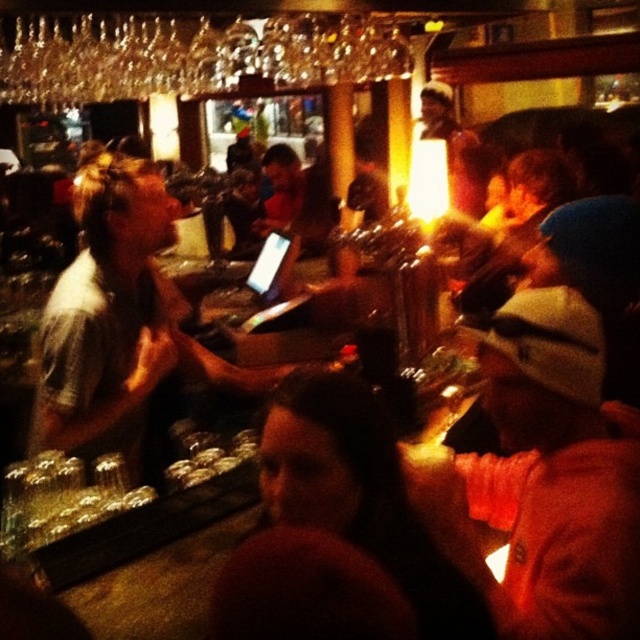
The width and height of the screenshot is (640, 640). What do you see at coordinates (563, 536) in the screenshot? I see `orange knit cap at lower right` at bounding box center [563, 536].

How much distance is there between orange knit cap at lower right and gray casual shirt at center?

A distance of 3.57 feet exists between orange knit cap at lower right and gray casual shirt at center.

Is point (620, 595) closer to viewer compared to point (120, 300)?

Yes, it is in front of point (120, 300).

Find the location of a particular element. Image resolution: width=640 pixels, height=640 pixels. orange knit cap at lower right is located at coordinates (563, 536).